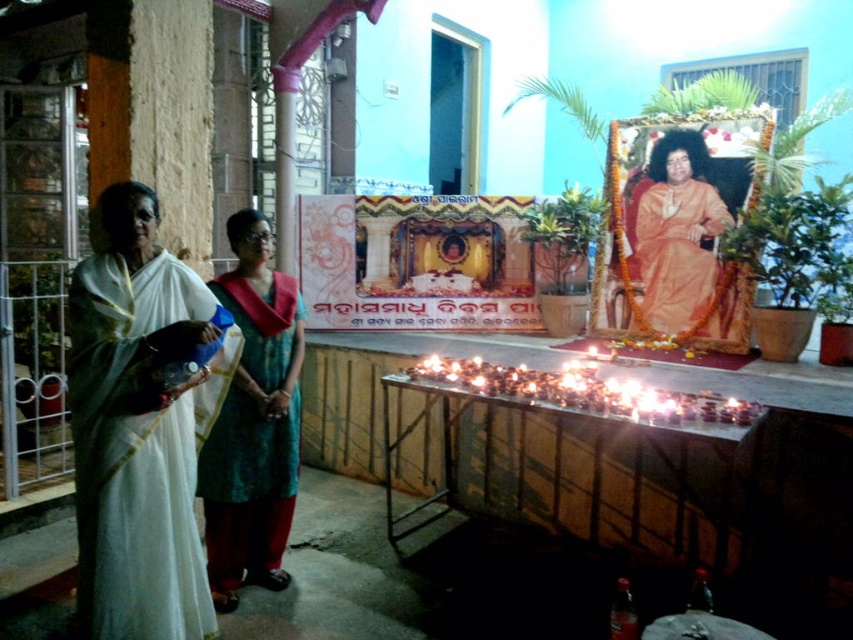
Which is behind, point (142, 396) or point (718, 300)?

Point (718, 300)

Where is `white silk saree at left`? white silk saree at left is located at coordinates (138, 428).

Find the location of a particular element. The width and height of the screenshot is (853, 640). white silk saree at left is located at coordinates (x=138, y=428).

Does teal silk saree at center have a lesser width compared to orange silk saree at center?

Yes.

Between teal silk saree at center and orange silk saree at center, which one has less height?

Standing shorter between the two is orange silk saree at center.

The image size is (853, 640). Find the location of `teal silk saree at center`. teal silk saree at center is located at coordinates (253, 420).

You are a GUI agent. You are given a task and a screenshot of the screen. Output one action in this format:
    pyautogui.click(x=<x>, y=<y>)
    Task: Click on the teal silk saree at center
    Image resolution: width=853 pixels, height=640 pixels.
    Given the screenshot: What is the action you would take?
    pyautogui.click(x=253, y=420)

Consider the image. Can you confirm if white silk saree at left is taller than teal silk saree at center?

No.

Does white silk saree at left appear under teal silk saree at center?

Incorrect, white silk saree at left is not positioned below teal silk saree at center.

Is point (135, 464) in front of point (285, 330)?

Yes.

At what (x,y) coordinates should I click in order to perform the action: click on white silk saree at left. Please return your answer as a coordinate pair (x, y). The width and height of the screenshot is (853, 640). Looking at the image, I should click on (138, 428).